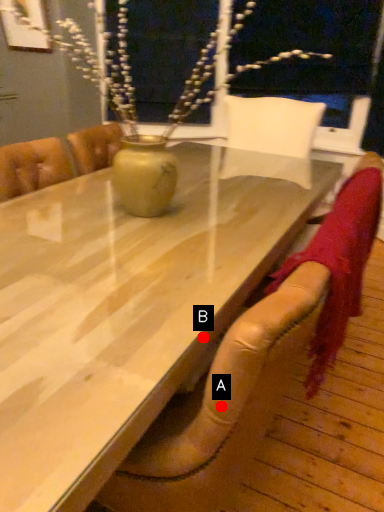
Question: Two points are circled on the image, labeled by A and B beside each circle. Which point is further to the camera?

Choices:
 (A) A is further
 (B) B is further

Answer: (B)